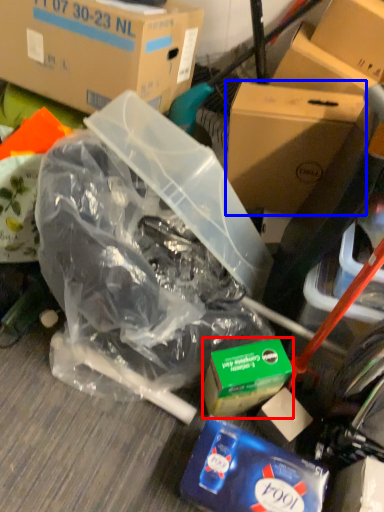
Question: Which object is further to the camera taking this photo, product (highlighted by a red box) or box (highlighted by a blue box)?

Choices:
 (A) product
 (B) box

Answer: (B)